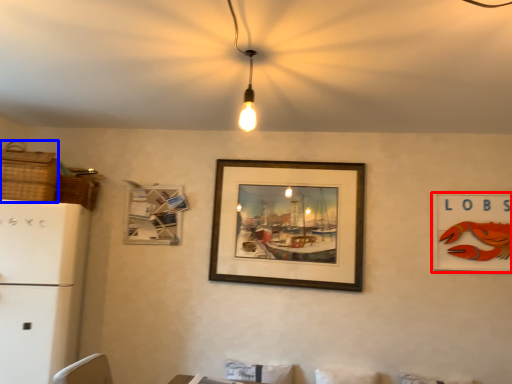
Question: Among these objects, which one is nearest to the camera, picture frame (highlighted by a red box) or basket (highlighted by a blue box)?

Choices:
 (A) picture frame
 (B) basket

Answer: (B)